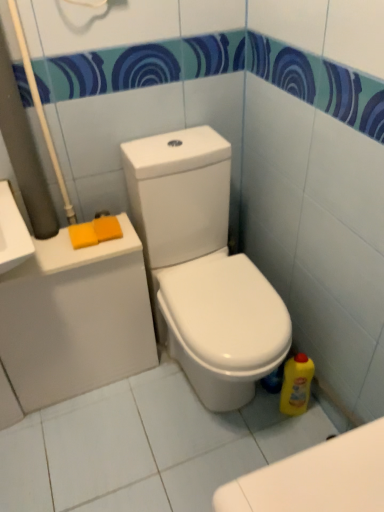
This screenshot has width=384, height=512. Find the location of `free spot to the left of yellow plastic bottle at lower right`. free spot to the left of yellow plastic bottle at lower right is located at coordinates (255, 422).